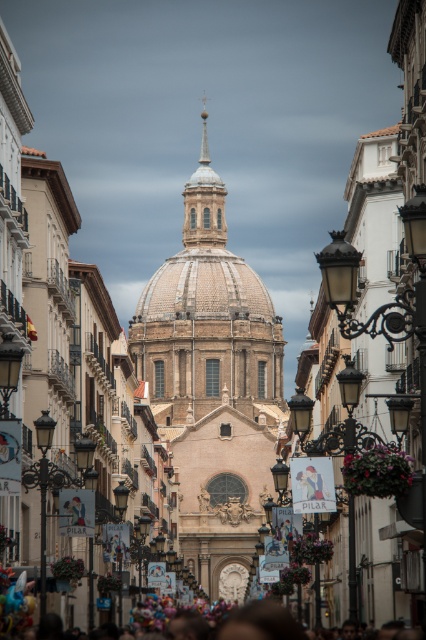
Question: Which point is farther from the camera taking this photo?

Choices:
 (A) (204, 348)
 (B) (149, 618)

Answer: (A)

Question: From the image, what is the correct spatial relationship of beige stone church at center in relation to multicolored fabric crowd at lower center?

Choices:
 (A) left
 (B) right

Answer: (A)

Question: Which of the following is the closest to the observer?

Choices:
 (A) multicolored fabric crowd at lower center
 (B) beige stone church at center

Answer: (A)

Question: Considering the relative positions of beige stone church at center and multicolored fabric crowd at lower center in the image provided, where is beige stone church at center located with respect to multicolored fabric crowd at lower center?

Choices:
 (A) left
 (B) right

Answer: (A)

Question: Where is beige stone church at center located in relation to multicolored fabric crowd at lower center in the image?

Choices:
 (A) left
 (B) right

Answer: (A)